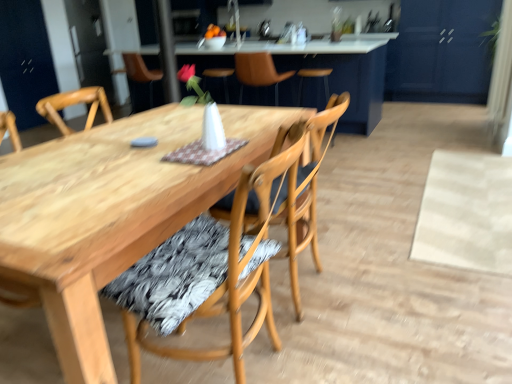
At what (x,y) coordinates should I click in order to perform the action: click on free location to the right of wooden chair at center, placed as the 2th chair when sorted from back to front. Please return your answer as a coordinate pair (x, y). This screenshot has height=384, width=512. Looking at the image, I should click on (400, 298).